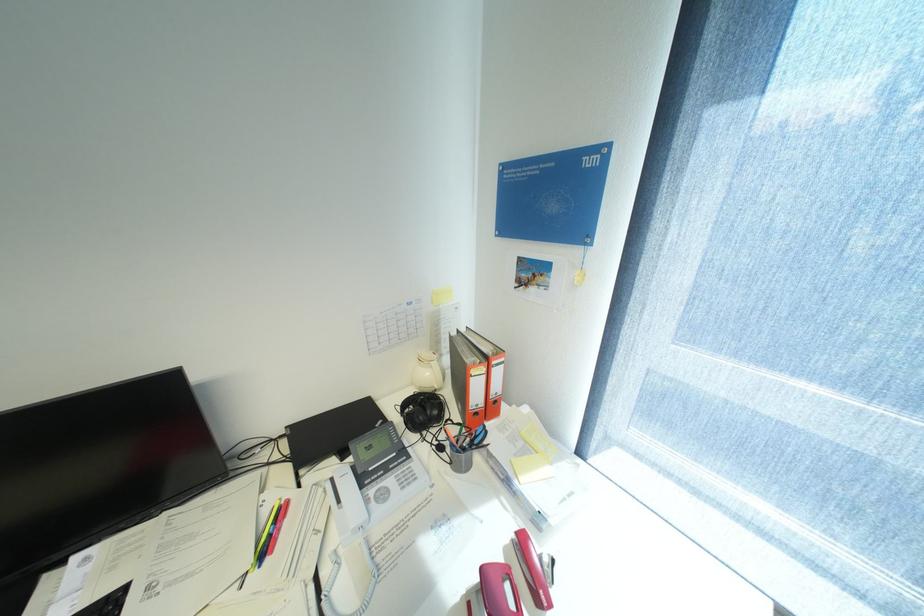
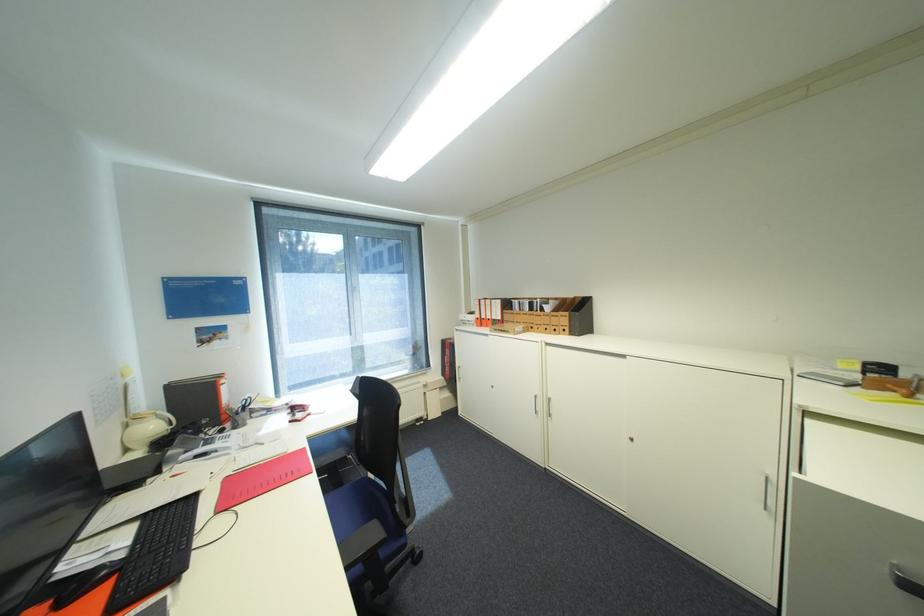
Where in the second image is the point corresponding to the point at 436,374 from the first image?

(161, 427)